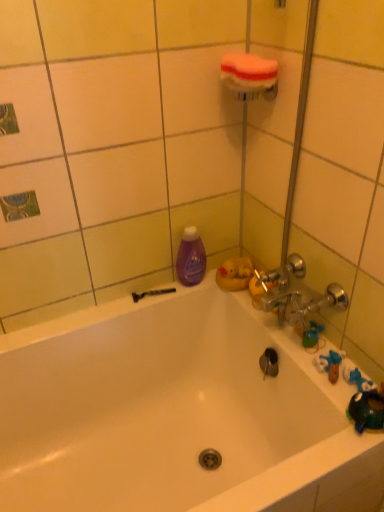
The width and height of the screenshot is (384, 512). In order to click on vacant space situated on the left part of black plastic razor at lower left in this screenshot , I will do `click(101, 312)`.